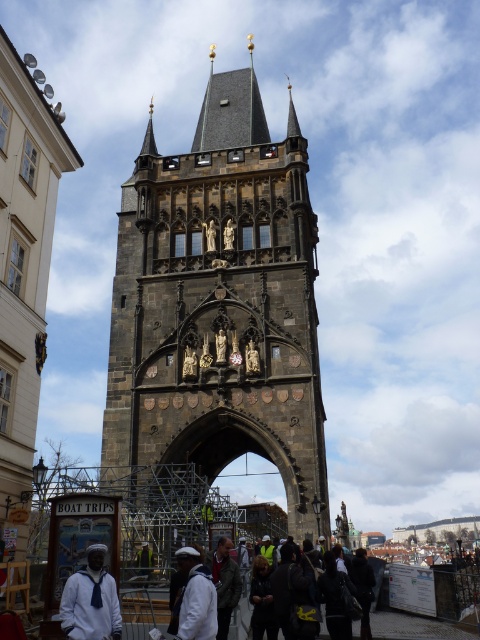
Question: Does dark gray stone tower at center have a larger size compared to white matte jacket at lower center?

Choices:
 (A) no
 (B) yes

Answer: (B)

Question: Can you confirm if dark gray stone spire at center top is positioned to the right of white matte jacket at lower center?

Choices:
 (A) no
 (B) yes

Answer: (A)

Question: Which object is closer to the camera taking this photo?

Choices:
 (A) white matte jacket at lower center
 (B) dark gray stone tower at center
 (C) dark gray stone spire at center top

Answer: (A)

Question: Which object is closer to the camera taking this photo?

Choices:
 (A) white matte jacket at lower center
 (B) dark gray stone spire at center top

Answer: (A)

Question: Can you confirm if dark gray stone tower at center is positioned to the left of white matte sailor suit at lower left?

Choices:
 (A) no
 (B) yes

Answer: (A)

Question: Which object appears closest to the camera in this image?

Choices:
 (A) white matte jacket at lower center
 (B) dark gray stone tower at center

Answer: (A)